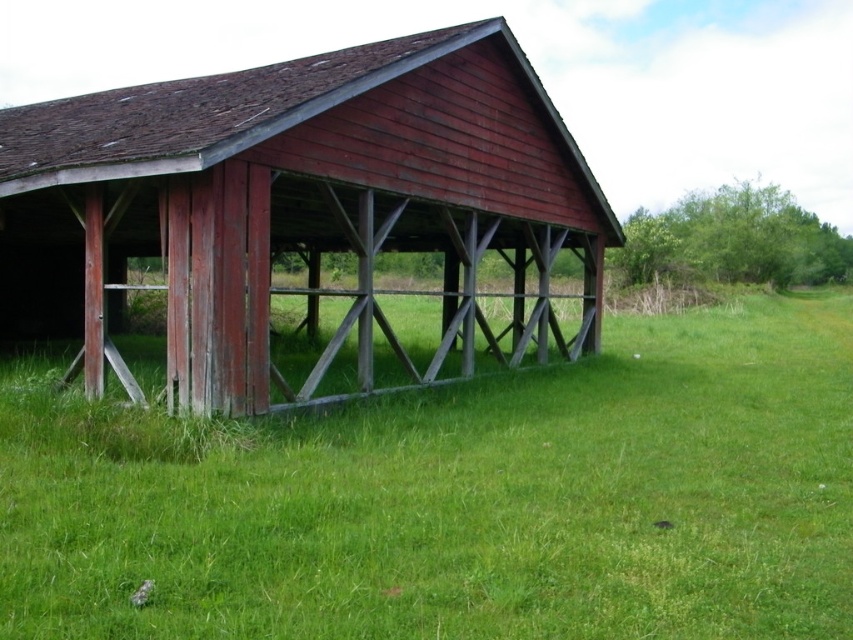
Consider the image. You are standing in a field and want to walk towards the matte wood barn at center. As you look down, you see the green grass at lower left. Which direction should you step to move toward the barn?

You should step away from the green grass at lower left since it is closer to you than the matte wood barn at center, meaning the barn is further back in the field.